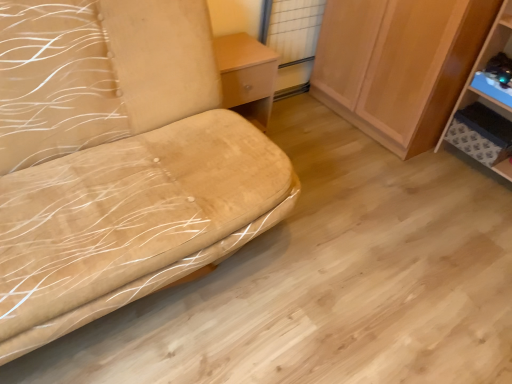
You are a GUI agent. You are given a task and a screenshot of the screen. Output one action in this format:
    pyautogui.click(x=<x>, y=<y>)
    Task: Click on the free space between suede-like beige sofa at left and blue plastic shelf at right
    The width and height of the screenshot is (512, 384).
    Given the screenshot: What is the action you would take?
    pyautogui.click(x=359, y=207)